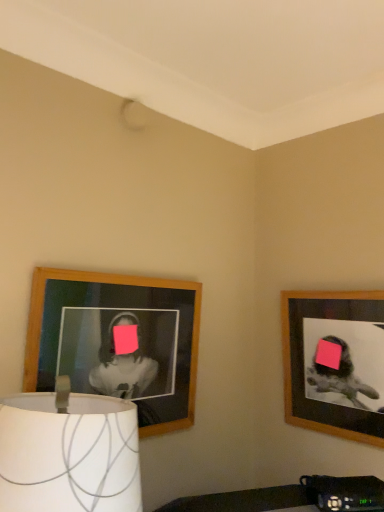
Question: In terms of width, does white fabric lampshade at lower left look wider or thinner when compared to wooden picture frame at left, arranged as the 2th picture frame when viewed from the right?

Choices:
 (A) wide
 (B) thin

Answer: (A)

Question: Is point (102, 443) closer or farther from the camera than point (89, 283)?

Choices:
 (A) closer
 (B) farther

Answer: (A)

Question: Based on their relative distances, which object is nearer to the wooden frame at upper right, the 1th picture frame positioned from the right?

Choices:
 (A) wooden picture frame at left, which is the first picture frame from left to right
 (B) white fabric lampshade at lower left

Answer: (A)

Question: Based on their relative distances, which object is nearer to the wooden picture frame at left, which is the first picture frame from left to right?

Choices:
 (A) wooden frame at upper right, which is the second picture frame from left to right
 (B) white fabric lampshade at lower left

Answer: (B)